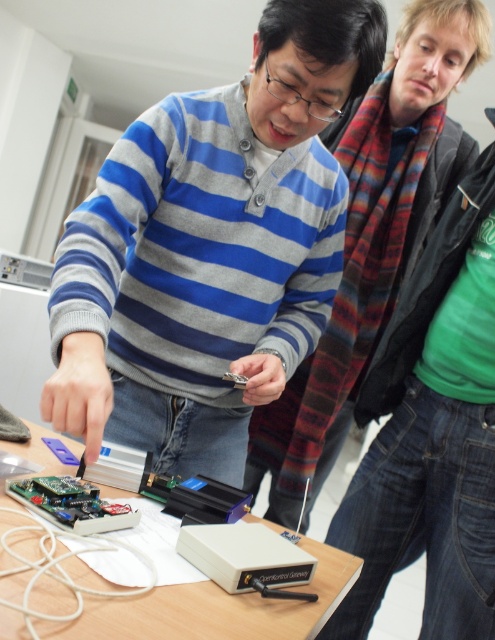
You are a technician who needs to place a 15 cm tall tool on the wooden table at center. The green circuit board at lower left is currently on the table. Can the tool be placed on the table without covering the circuit board?

The wooden table at center is much taller than the green circuit board at lower left. Since the table is significantly taller, there should be enough vertical space to place the 15 cm tall tool on the table without covering the circuit board.

You are organizing a small event and need to place a striped sweater at center on top of the wooden table at center. Will the sweater fit entirely on the table without overhanging the edges?

The striped sweater at center has a width less than the wooden table at center, so it will fit entirely on the table without overhanging the edges.

You are organizing a small workshop and need to place both the gray striped sweater at center and the wooden table at center on a shelf. The shelf has limited space. Which object should you place first to ensure both fit?

The wooden table at center is smaller than the gray striped sweater at center, so you should place the gray striped sweater at center first to accommodate its larger size before placing the wooden table at center.